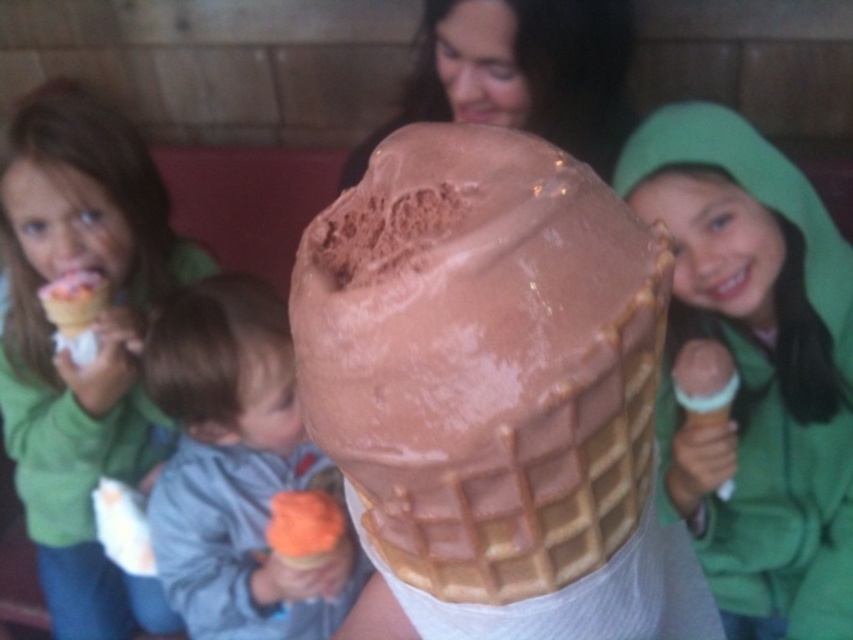
You are a photographer taking a picture of the smooth chocolate ice cream at center. To ensure the matte green hoodie at upper right doesn t block the view, should you move the hoodie to the left or right?

The matte green hoodie at upper right is to the right of the smooth chocolate ice cream at center. To avoid blocking the view, move the matte green hoodie at upper right to the left.

Consider the image. What are the coordinates of the smooth chocolate ice cream at center?

The smooth chocolate ice cream at center is located at point [521,74].